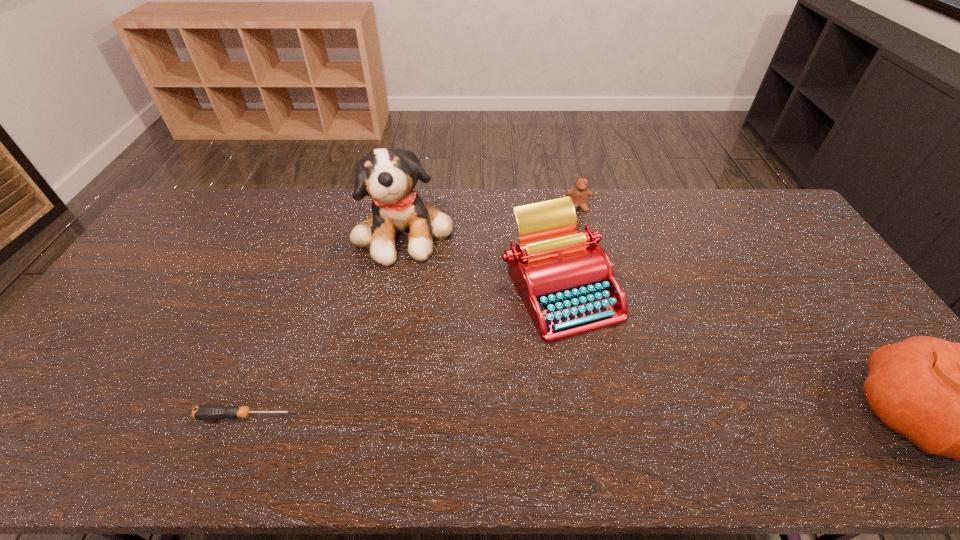
Locate an element on the screen. vacant area at the far edge is located at coordinates (286, 222).

Locate an element on the screen. vacant point at the near edge is located at coordinates (168, 411).

In the image, there is a desktop. Where is `vacant area at the left edge`? Image resolution: width=960 pixels, height=540 pixels. vacant area at the left edge is located at coordinates (122, 352).

Identify the location of vacant area at the far left corner of the desktop. (x=194, y=210).

Image resolution: width=960 pixels, height=540 pixels. In the image, there is a desktop. Find the location of `vacant region at the near left corner`. vacant region at the near left corner is located at coordinates (57, 388).

You are a GUI agent. You are given a task and a screenshot of the screen. Output one action in this format:
    pyautogui.click(x=<x>, y=<y>)
    Task: Click on the unoccupied area between the typewriter and the shortest object
    This screenshot has width=960, height=540.
    Given the screenshot: What is the action you would take?
    pyautogui.click(x=403, y=352)

Image resolution: width=960 pixels, height=540 pixels. Find the location of `free point between the screwdriver and the second shortest object`. free point between the screwdriver and the second shortest object is located at coordinates (413, 312).

Identify the location of vacant area between the second object from left to right and the screwdriver. (326, 323).

At what (x,y) coordinates should I click in order to perform the action: click on vacant area between the teddy bear and the puppy. Please return your answer as a coordinate pair (x, y). Looking at the image, I should click on (492, 219).

You are a GUI agent. You are given a task and a screenshot of the screen. Output one action in this format:
    pyautogui.click(x=<x>, y=<y>)
    Task: Click on the free space between the third shortest object and the tallest object
    Image resolution: width=960 pixels, height=540 pixels.
    Given the screenshot: What is the action you would take?
    pyautogui.click(x=483, y=260)